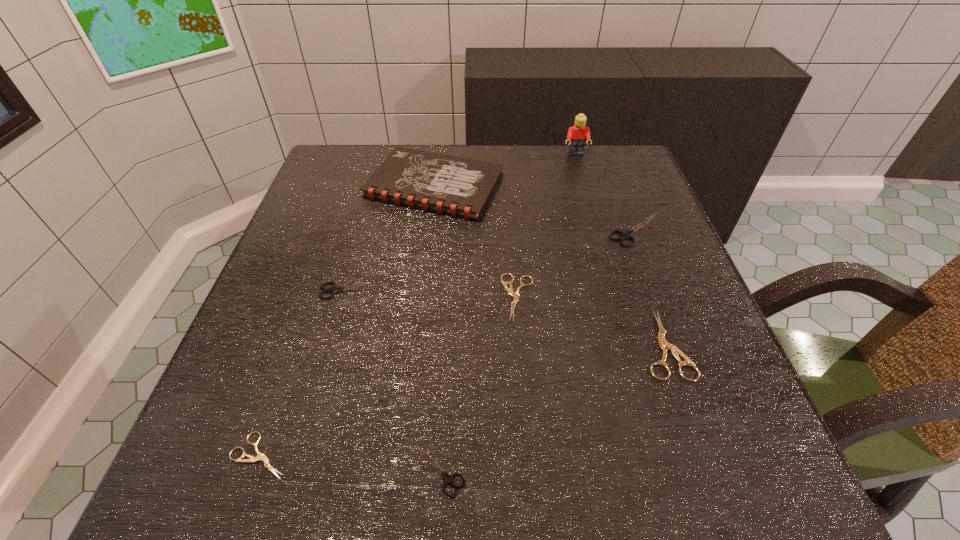
I want to click on the second closest beige shears relative to the biggest beige shears, so click(x=260, y=456).

Locate an element on the screen. the closest beige shears to the second biggest black shears is located at coordinates click(x=515, y=295).

At what (x,y) coordinates should I click in order to perform the action: click on vacant region that satisfies the following two spatial constraints: 1. on the back side of the second black shears from right to left; 2. on the right side of the tallest shears. Please return your answer as a coordinate pair (x, y). The image size is (960, 540). Looking at the image, I should click on (455, 230).

Image resolution: width=960 pixels, height=540 pixels. I want to click on free space that satisfies the following two spatial constraints: 1. on the front side of the second black shears from right to left; 2. on the right side of the shortest object, so click(x=254, y=470).